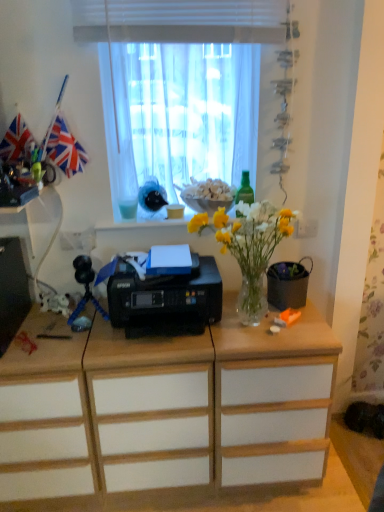
What is the approximate width of green glass bottle at upper center?

The width of green glass bottle at upper center is 1.95 inches.

Describe the element at coordinates (153, 426) in the screenshot. I see `white matte drawer at center, placed as the second drawer when sorted from left to right` at that location.

This screenshot has height=512, width=384. I want to click on white matte drawer at center, placed as the second drawer when sorted from left to right, so click(x=153, y=426).

Find the location of a particular element. This screenshot has height=512, width=384. black plastic printer at center is located at coordinates (165, 300).

What is the approximate height of black plastic printer at center?

22.21 centimeters.

Describe the element at coordinates (182, 89) in the screenshot. The height and width of the screenshot is (512, 384). I see `white sheer curtain at upper center` at that location.

Find the location of `white sheer curtain at upper center`. white sheer curtain at upper center is located at coordinates (182, 89).

Locate an element on the screen. Image resolution: width=384 pixels, height=512 pixels. green glass bottle at upper center is located at coordinates pyautogui.click(x=245, y=190).

The width and height of the screenshot is (384, 512). What are the coordinates of `bottle that is above the white matte drawer at center, the 1th drawer viewed from the right (from the image's perspective)` in the screenshot? It's located at (245, 190).

Looking at this image, is white matte drawer at center, placed as the second drawer when sorted from left to right, completely or partially outside of green glass bottle at upper center?

That's correct, white matte drawer at center, placed as the second drawer when sorted from left to right, is outside of green glass bottle at upper center.

From the image's perspective, is white matte drawer at center, placed as the second drawer when sorted from left to right, positioned above or below green glass bottle at upper center?

Clearly, from the image's perspective, white matte drawer at center, placed as the second drawer when sorted from left to right, is below green glass bottle at upper center.

Find the location of `printer that is under the red fabric flag at upper left (from a real-world perspective)`. printer that is under the red fabric flag at upper left (from a real-world perspective) is located at coordinates click(x=165, y=300).

Considering the relative sizes of red fabric flag at upper left and black plastic printer at center in the image provided, is red fabric flag at upper left thinner than black plastic printer at center?

Yes, red fabric flag at upper left is thinner than black plastic printer at center.

Which is behind, red fabric flag at upper left or black plastic printer at center?

red fabric flag at upper left.

Does red fabric flag at upper left have a smaller size compared to black plastic printer at center?

Yes, red fabric flag at upper left is smaller than black plastic printer at center.

From the image's perspective, between white matte drawer at center, placed as the second drawer when sorted from left to right, and red fabric flag at upper left, who is located below?

From the image's view, white matte drawer at center, placed as the second drawer when sorted from left to right, is below.

Can you confirm if white matte drawer at center, the 1th drawer viewed from the right, is thinner than red fabric flag at upper left?

No, white matte drawer at center, the 1th drawer viewed from the right, is not thinner than red fabric flag at upper left.

From a real-world perspective, is white matte drawer at center, placed as the second drawer when sorted from left to right, above or below red fabric flag at upper left?

In terms of real-world spatial position, white matte drawer at center, placed as the second drawer when sorted from left to right, is below red fabric flag at upper left.

Is white matte drawer at center, the 1th drawer viewed from the right, oriented towards red fabric flag at upper left?

No, white matte drawer at center, the 1th drawer viewed from the right, is not turned towards red fabric flag at upper left.

Is point (51, 159) behind point (240, 205)?

Yes.

Between red fabric flag at upper left and translucent glass vase at center, which one appears on the right side from the viewer's perspective?

translucent glass vase at center is more to the right.

From the image's perspective, relative to translucent glass vase at center, is red fabric flag at upper left above or below?

Based on their image positions, red fabric flag at upper left is located above translucent glass vase at center.

Is red fabric flag at upper left positioned beyond the bounds of translucent glass vase at center?

That's correct, red fabric flag at upper left is outside of translucent glass vase at center.

Is white wood drawer at center, which is counted as the first drawer, starting from the left, directly adjacent to white sheer curtain at upper center?

No, white wood drawer at center, which is counted as the first drawer, starting from the left, is not beside white sheer curtain at upper center.

Would you say white wood drawer at center, which is counted as the first drawer, starting from the left, is inside or outside white sheer curtain at upper center?

white wood drawer at center, which is counted as the first drawer, starting from the left, is not enclosed by white sheer curtain at upper center.

Considering the relative sizes of white wood drawer at center, the second drawer from the right, and white sheer curtain at upper center in the image provided, is white wood drawer at center, the second drawer from the right, bigger than white sheer curtain at upper center?

Yes.

Is white matte drawer at center, placed as the second drawer when sorted from left to right, taller or shorter than black plastic printer at center?

In the image, white matte drawer at center, placed as the second drawer when sorted from left to right, appears to be taller than black plastic printer at center.

Is white matte drawer at center, placed as the second drawer when sorted from left to right, directly adjacent to black plastic printer at center?

white matte drawer at center, placed as the second drawer when sorted from left to right, and black plastic printer at center are clearly separated.

From a real-world perspective, is white matte drawer at center, placed as the second drawer when sorted from left to right, positioned above or below black plastic printer at center?

In terms of real-world spatial position, white matte drawer at center, placed as the second drawer when sorted from left to right, is below black plastic printer at center.

Is point (116, 479) closer to viewer compared to point (128, 317)?

No.

From a real-world perspective, is green glass bottle at upper center over white matte drawer at center, the 1th drawer viewed from the right?

Yes, from a real-world perspective, green glass bottle at upper center is above white matte drawer at center, the 1th drawer viewed from the right.

How different are the orientations of green glass bottle at upper center and white matte drawer at center, the 1th drawer viewed from the right, in degrees?

green glass bottle at upper center and white matte drawer at center, the 1th drawer viewed from the right, are facing 0.686 degrees away from each other.

Find the location of a particular element. The height and width of the screenshot is (512, 384). bottle above the white matte drawer at center, the 1th drawer viewed from the right (from the image's perspective) is located at coordinates (245, 190).

Find the location of a particular element. This screenshot has height=512, width=384. bottle above the white matte drawer at center, the 1th drawer viewed from the right (from the image's perspective) is located at coordinates (245, 190).

Locate an element on the screen. printer in front of the red fabric flag at upper left is located at coordinates (165, 300).

From the image, which object appears to be nearer to black plastic printer at center, white sheer curtain at upper center or white wood drawer at center, the second drawer from the right?

white wood drawer at center, the second drawer from the right, is positioned closer to the anchor black plastic printer at center.

Looking at the image, which one is located closer to green glass bottle at upper center, white wood drawer at center, which is counted as the first drawer, starting from the left, or white matte drawer at center, the 1th drawer viewed from the right?

white matte drawer at center, the 1th drawer viewed from the right, is positioned closer to the anchor green glass bottle at upper center.

Considering their positions, is white wood drawer at center, the second drawer from the right, positioned further to white matte drawer at center, placed as the second drawer when sorted from left to right, than red fabric flag at upper left?

red fabric flag at upper left lies further to white matte drawer at center, placed as the second drawer when sorted from left to right, than the other object.

Estimate the real-world distances between objects in this image. Which object is further from red fabric flag at upper left, black plastic printer at center or white wood drawer at center, the second drawer from the right?

Based on the image, white wood drawer at center, the second drawer from the right, appears to be further to red fabric flag at upper left.

When comparing their distances from black plastic printer at center, does translucent glass vase at center or white wood drawer at center, which is counted as the first drawer, starting from the left, seem closer?

translucent glass vase at center is closer to black plastic printer at center.

From the picture: Based on their spatial positions, is green glass bottle at upper center or translucent glass vase at center closer to black plastic printer at center?

Based on the image, translucent glass vase at center appears to be nearer to black plastic printer at center.

Looking at the image, which one is located further to green glass bottle at upper center, white matte drawer at center, placed as the second drawer when sorted from left to right, or white sheer curtain at upper center?

white matte drawer at center, placed as the second drawer when sorted from left to right, is positioned further to the anchor green glass bottle at upper center.

Based on their spatial positions, is white sheer curtain at upper center or white wood drawer at center, the second drawer from the right, closer to white matte drawer at center, the 1th drawer viewed from the right?

white wood drawer at center, the second drawer from the right, is closer to white matte drawer at center, the 1th drawer viewed from the right.

This screenshot has width=384, height=512. What are the coordinates of `printer that lies between green glass bottle at upper center and white matte drawer at center, the 1th drawer viewed from the right, from top to bottom` in the screenshot? It's located at (165, 300).

Locate an element on the screen. Image resolution: width=384 pixels, height=512 pixels. floral arrangement between white sheer curtain at upper center and white matte drawer at center, placed as the second drawer when sorted from left to right, vertically is located at coordinates (249, 248).

The width and height of the screenshot is (384, 512). What are the coordinates of `bottle between white sheer curtain at upper center and black plastic printer at center in the up-down direction` in the screenshot? It's located at (245, 190).

At what (x,y) coordinates should I click in order to perform the action: click on bottle between red fabric flag at upper left and white matte drawer at center, placed as the second drawer when sorted from left to right, from top to bottom. Please return your answer as a coordinate pair (x, y). Image resolution: width=384 pixels, height=512 pixels. Looking at the image, I should click on (245, 190).